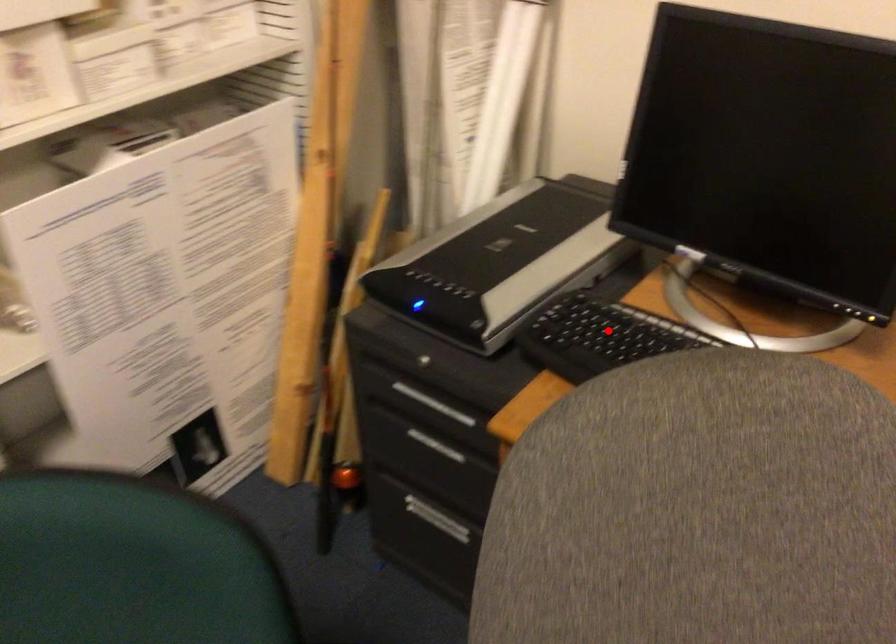
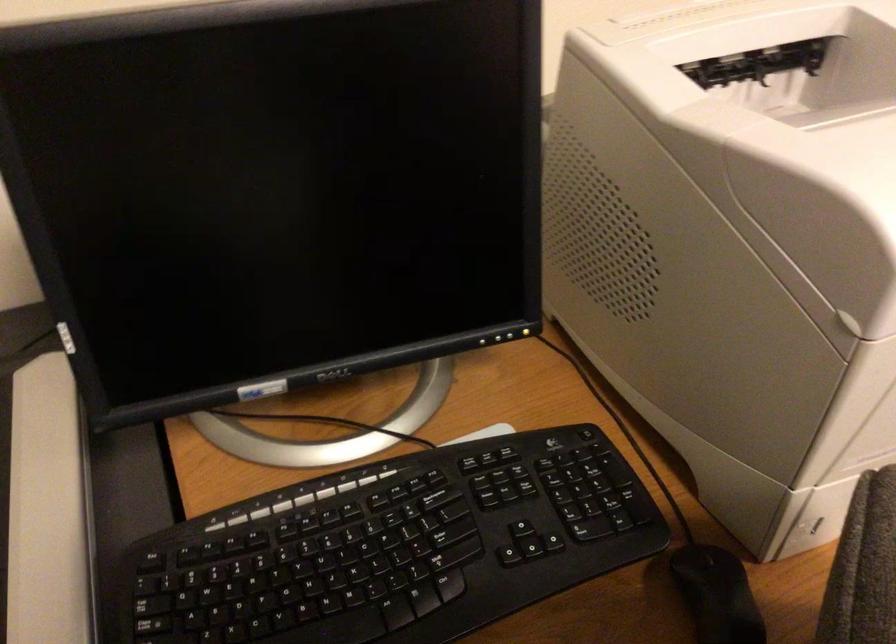
Question: I am providing you with two images of the same scene from different viewpoints. Given a red point in image1, look at the same physical point in image2. Is it:

Choices:
 (A) Closer to the viewpoint
 (B) Farther from the viewpoint

Answer: (A)